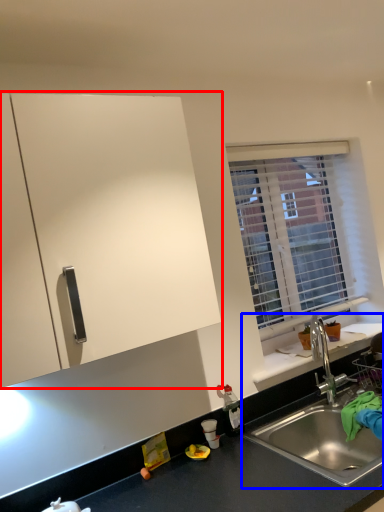
Question: Which object is further to the camera taking this photo, cabinetry (highlighted by a red box) or sink (highlighted by a blue box)?

Choices:
 (A) cabinetry
 (B) sink

Answer: (B)